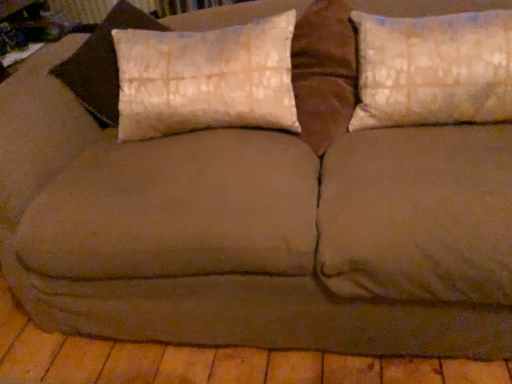
Question: From their relative heights in the image, would you say white textured pillow at center, which ranks as the second pillow in right-to-left order, is taller or shorter than textured beige pillow at upper right, arranged as the second pillow when viewed from the left?

Choices:
 (A) tall
 (B) short

Answer: (B)

Question: Is point (x=133, y=92) positioned closer to the camera than point (x=360, y=122)?

Choices:
 (A) farther
 (B) closer

Answer: (A)

Question: Visually, is white textured pillow at center, marked as the first pillow in a left-to-right arrangement, positioned to the left or to the right of textured beige pillow at upper right, which is the first pillow in right-to-left order?

Choices:
 (A) right
 (B) left

Answer: (B)

Question: In terms of width, does textured beige pillow at upper right, which is the first pillow in right-to-left order, look wider or thinner when compared to white textured pillow at center, which ranks as the second pillow in right-to-left order?

Choices:
 (A) wide
 (B) thin

Answer: (B)

Question: Is point (412, 29) positioned closer to the camera than point (117, 31)?

Choices:
 (A) farther
 (B) closer

Answer: (B)

Question: Considering the relative positions of textured beige pillow at upper right, which is the first pillow in right-to-left order, and white textured pillow at center, marked as the first pillow in a left-to-right arrangement, in the image provided, is textured beige pillow at upper right, which is the first pillow in right-to-left order, to the left or to the right of white textured pillow at center, marked as the first pillow in a left-to-right arrangement,?

Choices:
 (A) right
 (B) left

Answer: (A)

Question: From a real-world perspective, is textured beige pillow at upper right, arranged as the second pillow when viewed from the left, physically located above or below white textured pillow at center, which ranks as the second pillow in right-to-left order?

Choices:
 (A) above
 (B) below

Answer: (B)